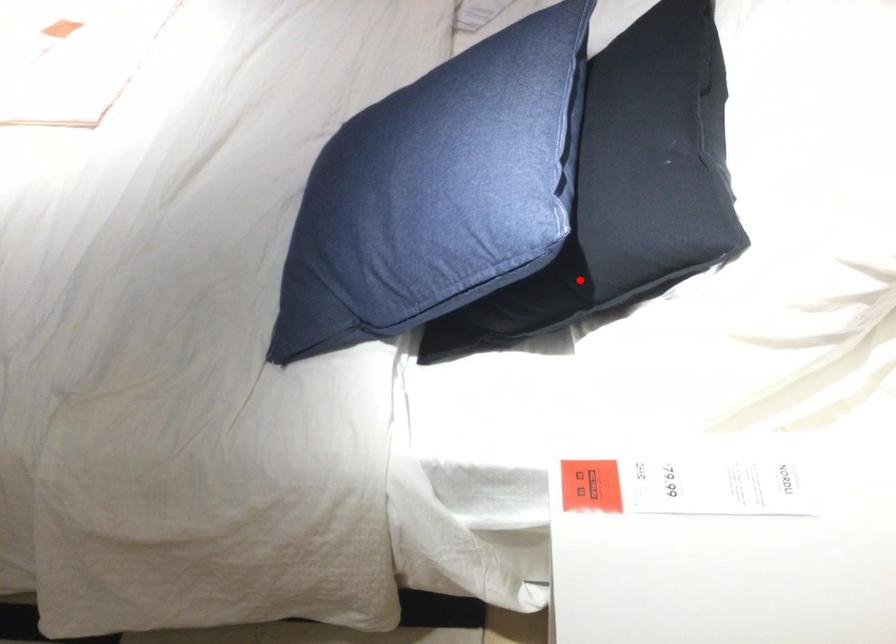
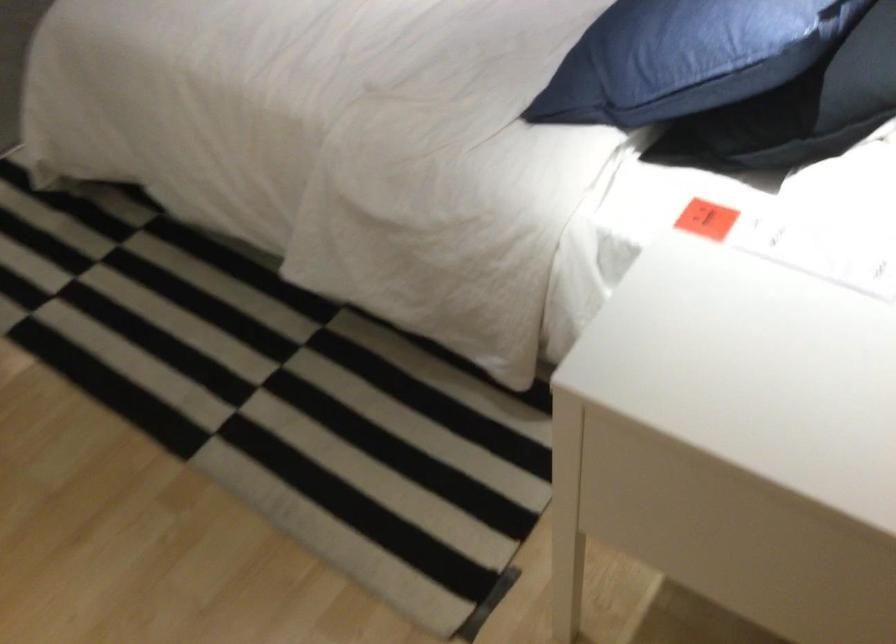
Find the pixel in the second image that matches the highlighted location in the first image.

(808, 108)